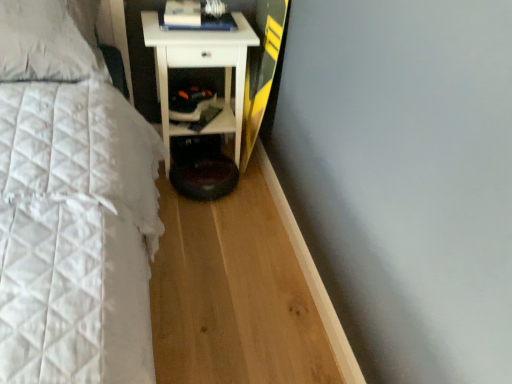
Question: Are hardcover book at upper center and white glossy cabinet at lower center making contact?

Choices:
 (A) yes
 (B) no

Answer: (B)

Question: Does hardcover book at upper center appear on the left side of white glossy cabinet at lower center?

Choices:
 (A) yes
 (B) no

Answer: (B)

Question: From the image's perspective, would you say hardcover book at upper center is shown under white glossy cabinet at lower center?

Choices:
 (A) yes
 (B) no

Answer: (B)

Question: Considering the relative sizes of hardcover book at upper center and white glossy cabinet at lower center in the image provided, is hardcover book at upper center wider than white glossy cabinet at lower center?

Choices:
 (A) yes
 (B) no

Answer: (B)

Question: From a real-world perspective, is hardcover book at upper center physically above white glossy cabinet at lower center?

Choices:
 (A) yes
 (B) no

Answer: (A)

Question: Which is correct: hardcover book at upper center is inside white glossy cabinet at lower center, or outside of it?

Choices:
 (A) inside
 (B) outside

Answer: (B)

Question: From the image's perspective, is hardcover book at upper center located above or below white glossy cabinet at lower center?

Choices:
 (A) below
 (B) above

Answer: (B)

Question: Based on their sizes in the image, would you say hardcover book at upper center is bigger or smaller than white glossy cabinet at lower center?

Choices:
 (A) big
 (B) small

Answer: (B)

Question: From a real-world perspective, is hardcover book at upper center above or below white glossy cabinet at lower center?

Choices:
 (A) below
 (B) above

Answer: (B)

Question: From a real-world perspective, is white quilted pillow at upper left positioned above or below hardcover book at upper center?

Choices:
 (A) below
 (B) above

Answer: (B)

Question: In terms of width, does white quilted pillow at upper left look wider or thinner when compared to hardcover book at upper center?

Choices:
 (A) thin
 (B) wide

Answer: (B)

Question: Is point (50, 76) positioned closer to the camera than point (174, 1)?

Choices:
 (A) closer
 (B) farther

Answer: (A)

Question: Is white quilted pillow at upper left inside the boundaries of hardcover book at upper center, or outside?

Choices:
 (A) outside
 (B) inside

Answer: (A)

Question: Is white glossy cabinet at lower center bigger or smaller than white glossy nightstand at center?

Choices:
 (A) small
 (B) big

Answer: (A)

Question: Visually, is white glossy cabinet at lower center positioned to the left or to the right of white glossy nightstand at center?

Choices:
 (A) right
 (B) left

Answer: (B)